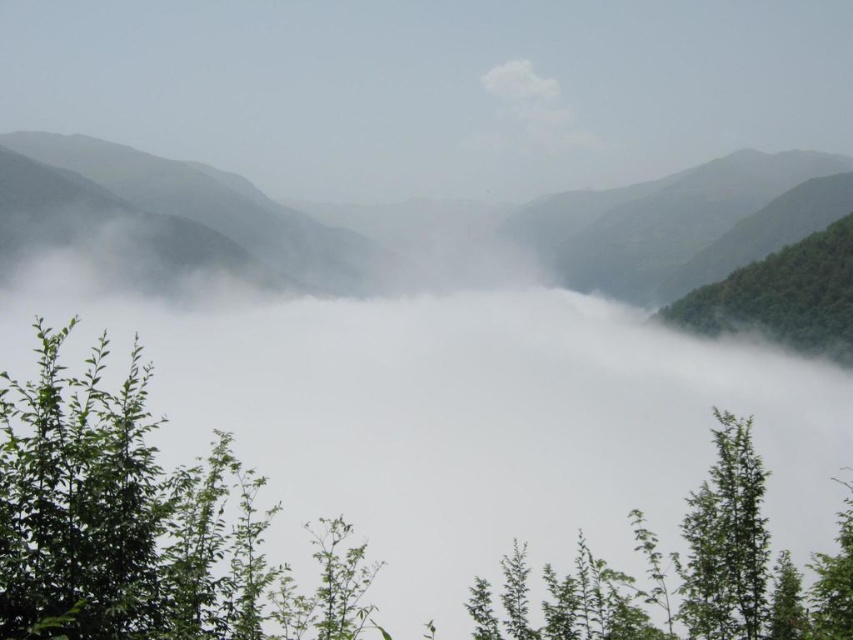
You are a hiker planning to take a photo of the green leafy tree at lower left and the green matte mountain at center. Based on their positions, which object should you focus on first to ensure both are in the frame?

The green leafy tree at lower left is located below the green matte mountain at center, so you should focus on the green leafy tree at lower left first to ensure both are in the frame.

You are standing in the misty valley and want to take a photo of the green leafy tree at lower left and the green matte mountain at center. Which object will appear closer to the camera in the photo?

The green leafy tree at lower left will appear closer to the camera in the photo because it is positioned in front of the green matte mountain at center.